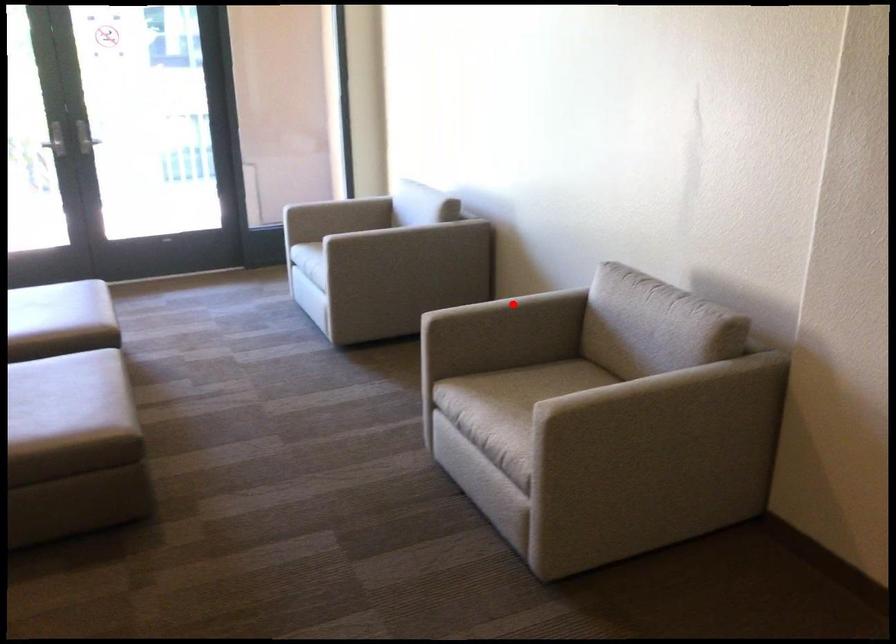
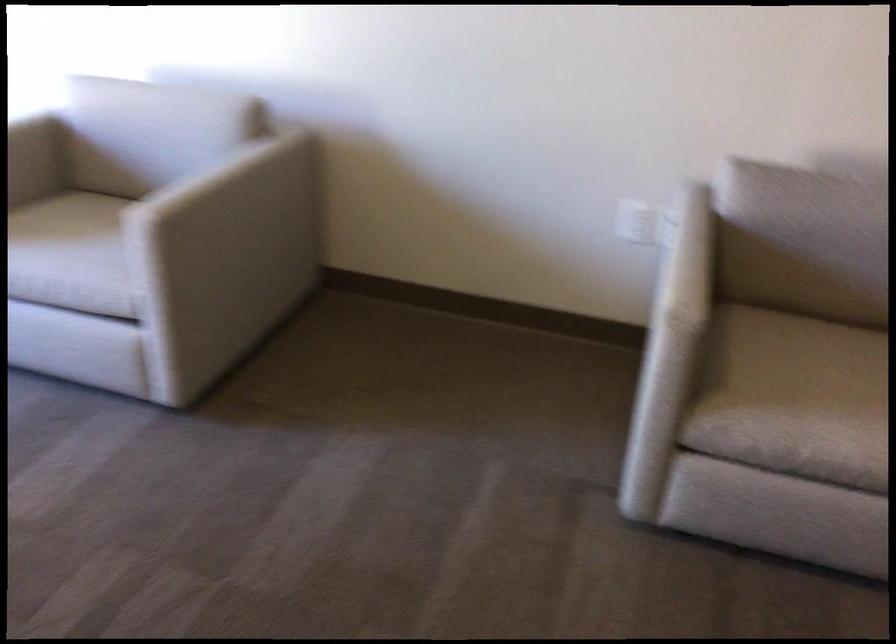
Question: A red point is marked in image1. In image2, is the corresponding 3D point closer to the camera or farther? Reply with the corresponding letter.

Choices:
 (A) The corresponding 3D point is closer.
 (B) The corresponding 3D point is farther.

Answer: (A)